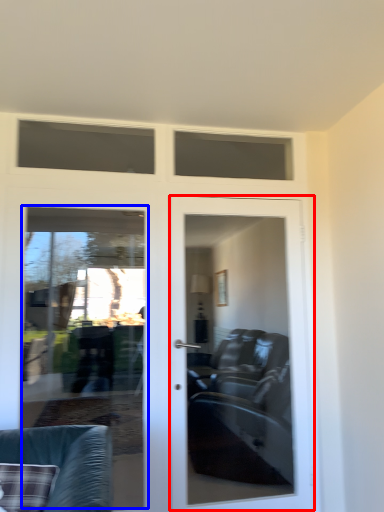
Question: Which of the following is the closest to the observer, door (highlighted by a red box) or screen door (highlighted by a blue box)?

Choices:
 (A) door
 (B) screen door

Answer: (B)